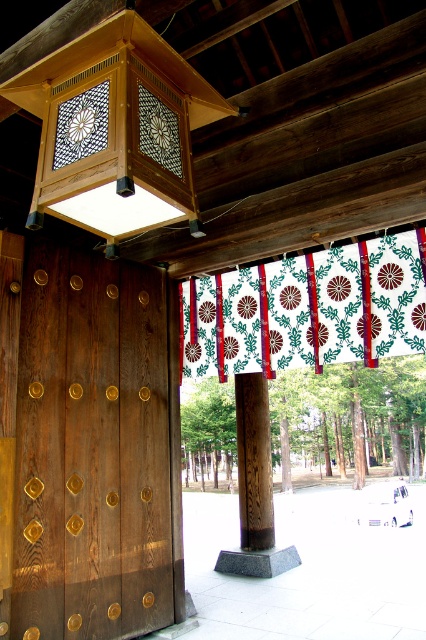
Question: Can you confirm if dark brown wood at center is positioned below white fabric with floral pattern at center?

Choices:
 (A) yes
 (B) no

Answer: (A)

Question: Does dark brown wood at center have a smaller size compared to white fabric with floral pattern at center?

Choices:
 (A) no
 (B) yes

Answer: (A)

Question: Which object is closer to the camera taking this photo?

Choices:
 (A) dark brown wood at center
 (B) white fabric with floral pattern at center

Answer: (A)

Question: Which object appears closest to the camera in this image?

Choices:
 (A) dark brown wood at center
 (B) white fabric with floral pattern at center

Answer: (A)

Question: Can you confirm if dark brown wood at center is positioned to the left of white fabric with floral pattern at center?

Choices:
 (A) yes
 (B) no

Answer: (A)